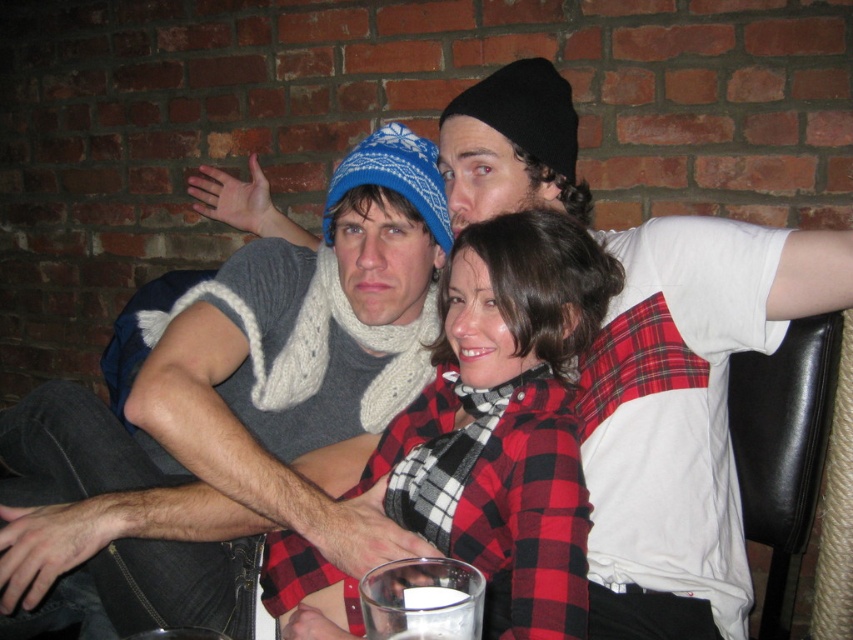
In the scene described, there are two items of interest. The first is the knitted wool hat at upper center, and the second is the white opaque liquid at lower center. From the perspective of an observer looking at the image, which of these two items is positioned to the left?

The knitted wool hat at upper center is positioned to the left of the white opaque liquid at lower center.

You are a photographer at a social event and want to capture a closeup of the red plaid shirt at center without including the white opaque liquid at lower center in the frame. Given that they are 14.35 inches apart, what is the minimum distance you should position your camera from the subjects to ensure the liquid is out of the shot?

The red plaid shirt at center and white opaque liquid at lower center are 14.35 inches apart. To exclude the white opaque liquid at lower center from the frame while focusing on the red plaid shirt at center, the camera should be positioned at least 14.35 inches away from the subjects.